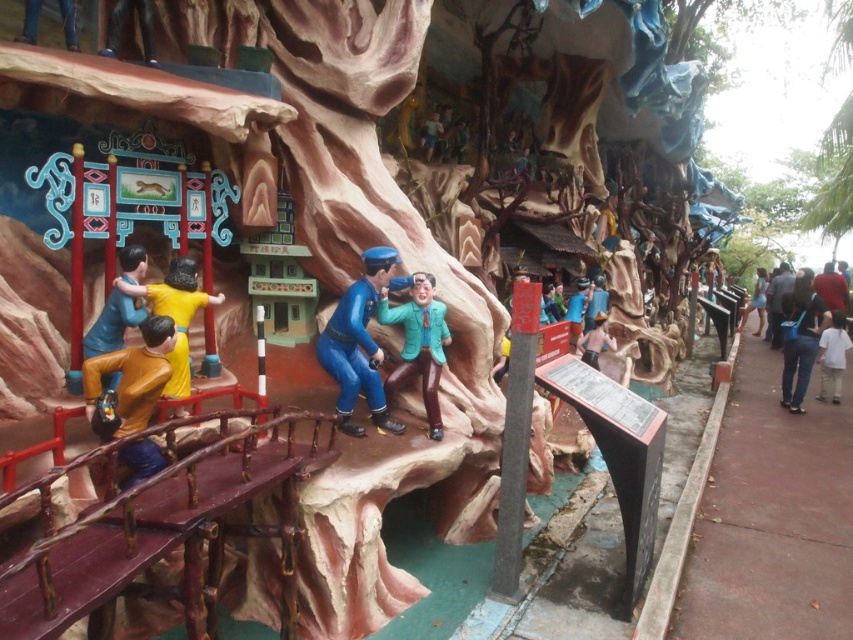
Consider the image. Does dark blue uniform at right have a greater width compared to red fabric shirt at right?

In fact, dark blue uniform at right might be narrower than red fabric shirt at right.

From the picture: Who is taller, dark blue uniform at right or red fabric shirt at right?

With more height is red fabric shirt at right.

Is point (775, 294) behind point (840, 285)?

Yes, it is.

At what (x,y) coordinates should I click in order to perform the action: click on dark blue uniform at right. Please return your answer as a coordinate pair (x, y). Looking at the image, I should click on (776, 301).

Is blue glossy uniform at center positioned behind teal matte jacket at center?

No.

Is blue glossy uniform at center above teal matte jacket at center?

Yes, blue glossy uniform at center is above teal matte jacket at center.

Find the location of a particular element. blue glossy uniform at center is located at coordinates (358, 344).

Looking at this image, who is lower down, matte yellow jacket at lower left or white cotton shirt at right?

white cotton shirt at right is below.

Can you confirm if matte yellow jacket at lower left is smaller than white cotton shirt at right?

Yes, matte yellow jacket at lower left is smaller than white cotton shirt at right.

The width and height of the screenshot is (853, 640). Describe the element at coordinates (132, 374) in the screenshot. I see `matte yellow jacket at lower left` at that location.

Find the location of `matte yellow jacket at lower left`. matte yellow jacket at lower left is located at coordinates (132, 374).